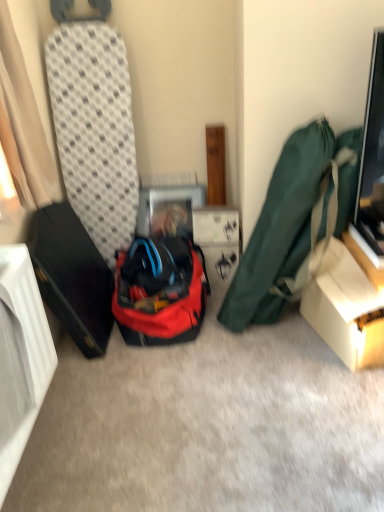
What do you see at coordinates (25, 116) in the screenshot?
I see `beige fabric curtain at left` at bounding box center [25, 116].

This screenshot has height=512, width=384. What do you see at coordinates (288, 222) in the screenshot?
I see `green fabric bag at right` at bounding box center [288, 222].

The width and height of the screenshot is (384, 512). Describe the element at coordinates (346, 309) in the screenshot. I see `matte cardboard box at lower right` at that location.

You are a GUI agent. You are given a task and a screenshot of the screen. Output one action in this format:
    pyautogui.click(x=<x>, y=<y>)
    Task: Click on the red fabric backpack at center
    
    Given the screenshot: What is the action you would take?
    pyautogui.click(x=160, y=291)

You are a GUI agent. You are given a task and a screenshot of the screen. Output one action in this format:
    pyautogui.click(x=<x>, y=<y>)
    Task: Click on the beige fabric curtain at left
    This screenshot has height=512, width=384.
    Given the screenshot: What is the action you would take?
    pyautogui.click(x=25, y=116)

From a real-world perspective, is green fabric bag at right positioned under red fabric backpack at center based on gravity?

Actually, green fabric bag at right is physically above red fabric backpack at center in the real world.

Visually, is green fabric bag at right positioned to the left or to the right of red fabric backpack at center?

Based on their positions, green fabric bag at right is located to the right of red fabric backpack at center.

Which point is more distant from viewer, (x=328, y=157) or (x=159, y=324)?

The point (x=159, y=324) is behind.

How many degrees apart are the facing directions of green fabric bag at right and red fabric backpack at center?

green fabric bag at right and red fabric backpack at center are facing 0.0368 degrees away from each other.

Which is correct: green fabric bag at right is inside matte cardboard box at lower right, or outside of it?

green fabric bag at right is outside matte cardboard box at lower right.

Is matte cardboard box at lower right at the back of green fabric bag at right?

No, matte cardboard box at lower right is not at the back of green fabric bag at right.

From a real-world perspective, is green fabric bag at right physically below matte cardboard box at lower right?

No, from a real-world perspective, green fabric bag at right is not beneath matte cardboard box at lower right.

In the image, is green fabric bag at right positioned in front of or behind matte cardboard box at lower right?

In the image, green fabric bag at right appears in front of matte cardboard box at lower right.

Looking at this image, does matte cardboard box at lower right have a lesser width compared to green fabric bag at right?

Yes, matte cardboard box at lower right is thinner than green fabric bag at right.

Is matte cardboard box at lower right placed right next to green fabric bag at right?

There is a gap between matte cardboard box at lower right and green fabric bag at right.

Measure the distance between matte cardboard box at lower right and green fabric bag at right.

They are 9.12 inches apart.

Which is in front, matte cardboard box at lower right or green fabric bag at right?

green fabric bag at right.

Is green fabric bag at right completely or partially outside of beige fabric curtain at left?

Yes, green fabric bag at right is located beyond the bounds of beige fabric curtain at left.

How far apart are green fabric bag at right and beige fabric curtain at left?

They are 33.98 inches apart.

Is green fabric bag at right to the right of beige fabric curtain at left from the viewer's perspective?

Indeed, green fabric bag at right is positioned on the right side of beige fabric curtain at left.

Does point (340, 220) come closer to viewer compared to point (7, 28)?

No, it is behind (7, 28).

Based on their positions, is white cardboard box at center located to the left or right of red fabric backpack at center?

Based on their positions, white cardboard box at center is located to the right of red fabric backpack at center.

Image resolution: width=384 pixels, height=512 pixels. Find the location of `cardboard box directly beneath the red fabric backpack at center (from a real-world perspective)`. cardboard box directly beneath the red fabric backpack at center (from a real-world perspective) is located at coordinates (217, 243).

Considering the relative sizes of white cardboard box at center and red fabric backpack at center in the image provided, is white cardboard box at center wider than red fabric backpack at center?

No.

Considering the sizes of objects white cardboard box at center and red fabric backpack at center in the image provided, who is shorter, white cardboard box at center or red fabric backpack at center?

With less height is white cardboard box at center.

Which object is more forward, red fabric backpack at center or white cardboard box at center?

red fabric backpack at center.

Can you tell me how much red fabric backpack at center and white cardboard box at center differ in facing direction?

There is a 0.000494-degree angle between the facing directions of red fabric backpack at center and white cardboard box at center.

Is red fabric backpack at center inside or outside of white cardboard box at center?

red fabric backpack at center is located beyond the bounds of white cardboard box at center.

Is matte cardboard box at lower right bigger or smaller than beige fabric curtain at left?

Clearly, matte cardboard box at lower right is smaller in size than beige fabric curtain at left.

Which object is closer to the camera taking this photo, matte cardboard box at lower right or beige fabric curtain at left?

beige fabric curtain at left is more forward.

Is matte cardboard box at lower right looking in the opposite direction of beige fabric curtain at left?

No, beige fabric curtain at left is not at the back of matte cardboard box at lower right.

Where is `luggage and bags lying above the red fabric backpack at center (from the image's perspective)`? luggage and bags lying above the red fabric backpack at center (from the image's perspective) is located at coordinates (288, 222).

Where is `box located behind the green fabric bag at right`? box located behind the green fabric bag at right is located at coordinates (346, 309).

From the image, which object appears to be nearer to matte cardboard box at lower right, red fabric backpack at center or white cardboard box at center?

white cardboard box at center is closer to matte cardboard box at lower right.

Considering their positions, is white cardboard box at center positioned closer to matte cardboard box at lower right than beige fabric curtain at left?

The object closer to matte cardboard box at lower right is white cardboard box at center.

Considering their positions, is green fabric bag at right positioned closer to beige fabric curtain at left than matte cardboard box at lower right?

green fabric bag at right.

When comparing their distances from green fabric bag at right, does red fabric backpack at center or beige fabric curtain at left seem closer?

Based on the image, red fabric backpack at center appears to be nearer to green fabric bag at right.

Estimate the real-world distances between objects in this image. Which object is closer to beige fabric curtain at left, white cardboard box at center or matte cardboard box at lower right?

The object closer to beige fabric curtain at left is white cardboard box at center.

Which object lies nearer to the anchor point green fabric bag at right, beige fabric curtain at left or white cardboard box at center?

white cardboard box at center lies closer to green fabric bag at right than the other object.

Which object lies nearer to the anchor point white cardboard box at center, matte cardboard box at lower right or beige fabric curtain at left?

matte cardboard box at lower right is positioned closer to the anchor white cardboard box at center.

Based on their spatial positions, is white cardboard box at center or green fabric bag at right closer to red fabric backpack at center?

white cardboard box at center is closer to red fabric backpack at center.

Locate an element on the screen. The image size is (384, 512). backpack located between green fabric bag at right and white cardboard box at center in the depth direction is located at coordinates (160, 291).

Where is `cardboard box situated between beige fabric curtain at left and matte cardboard box at lower right from left to right`? This screenshot has width=384, height=512. cardboard box situated between beige fabric curtain at left and matte cardboard box at lower right from left to right is located at coordinates (217, 243).

Locate an element on the screen. Image resolution: width=384 pixels, height=512 pixels. backpack between beige fabric curtain at left and green fabric bag at right is located at coordinates (160, 291).

This screenshot has width=384, height=512. I want to click on backpack situated between beige fabric curtain at left and matte cardboard box at lower right from left to right, so [160, 291].